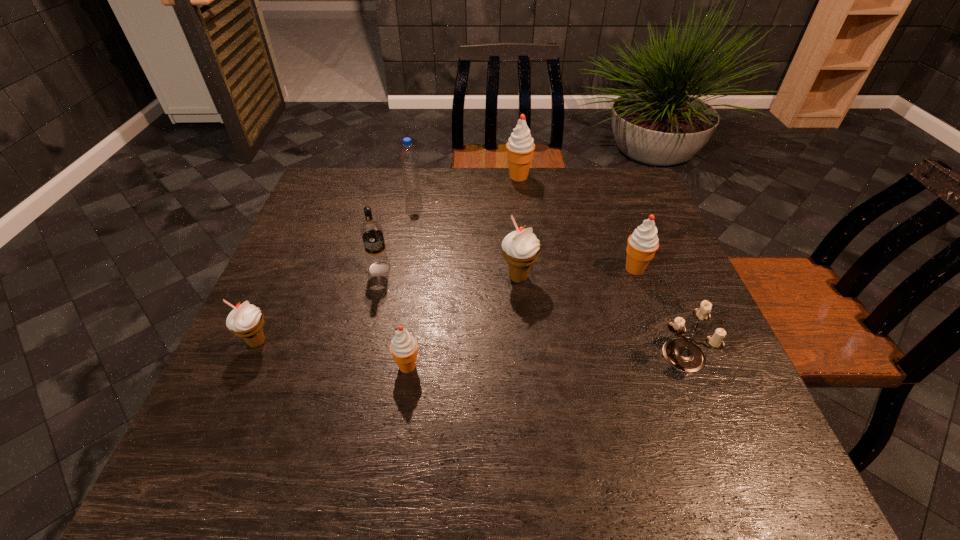
Locate an element on the screen. This screenshot has width=960, height=540. the tallest icecream is located at coordinates (520, 147).

The height and width of the screenshot is (540, 960). Identify the location of the farthest icecream. (520, 147).

The image size is (960, 540). Identify the location of water bottle. (412, 186).

I want to click on vodka, so click(x=378, y=263).

You are a GUI agent. You are given a task and a screenshot of the screen. Output one action in this format:
    pyautogui.click(x=<x>, y=<y>)
    Task: Click on the bigger white icecream
    The width and height of the screenshot is (960, 540).
    Given the screenshot: What is the action you would take?
    pyautogui.click(x=521, y=248)

This screenshot has width=960, height=540. I want to click on the farther white icecream, so click(521, 248).

Locate an element on the screen. This screenshot has width=960, height=540. the second farthest red icecream is located at coordinates (642, 244).

Where is `the rightmost red icecream`? the rightmost red icecream is located at coordinates (642, 244).

The image size is (960, 540). I want to click on candle holder, so click(683, 355).

The image size is (960, 540). Find the location of `the smallest red icecream`. the smallest red icecream is located at coordinates (403, 347).